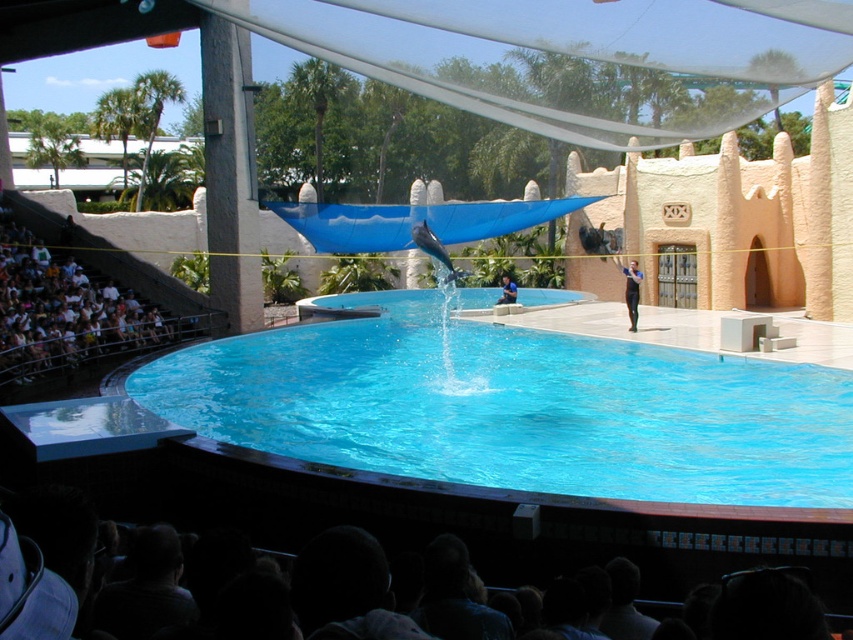
Between black wetsuit at center and dark blue shirt at center, which one has more height?

black wetsuit at center

Who is lower down, black wetsuit at center or dark blue shirt at center?

dark blue shirt at center is lower down.

Does point (637, 289) come closer to viewer compared to point (502, 301)?

Yes.

The image size is (853, 640). I want to click on black wetsuit at center, so click(630, 289).

Can you confirm if transparent glass pool at center is positioned below white fabric seat at left?

Yes.

Does point (489, 385) lie behind point (15, 241)?

No, (489, 385) is in front of (15, 241).

Find the location of a particular element. The height and width of the screenshot is (640, 853). transparent glass pool at center is located at coordinates (515, 406).

Which is more to the right, white fabric seat at left or dark blue shirt at center?

dark blue shirt at center is more to the right.

Can you confirm if white fabric seat at left is positioned to the right of dark blue shirt at center?

In fact, white fabric seat at left is to the left of dark blue shirt at center.

Is point (59, 298) closer to camera compared to point (511, 296)?

Yes, point (59, 298) is closer to viewer.

The width and height of the screenshot is (853, 640). Find the location of `white fabric seat at left`. white fabric seat at left is located at coordinates (64, 310).